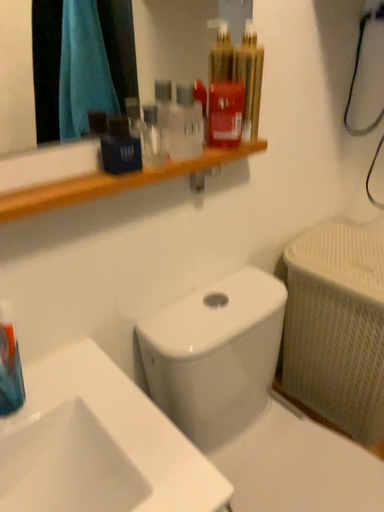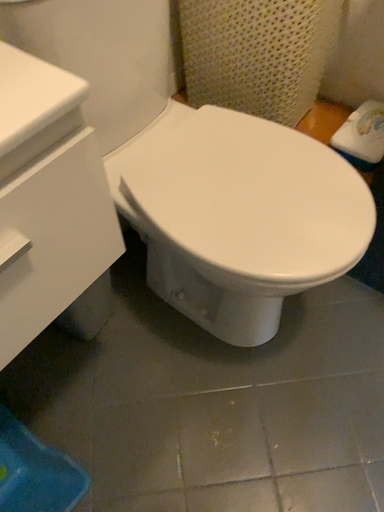
Question: Which way did the camera rotate in the video?

Choices:
 (A) rotated right
 (B) rotated left

Answer: (A)